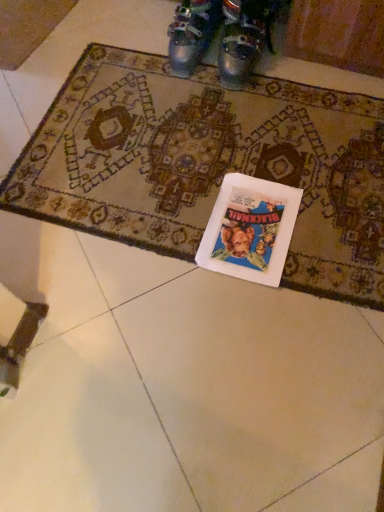
Question: Is metallic silver shoes at upper center, arranged as the 1th footwear when viewed from the right, in front of metallic silver boots at upper center, which is counted as the first footwear, starting from the left?

Choices:
 (A) yes
 (B) no

Answer: (A)

Question: Is metallic silver shoes at upper center, which ranks as the second footwear in left-to-right order, bigger than metallic silver boots at upper center, the second footwear when ordered from right to left?

Choices:
 (A) no
 (B) yes

Answer: (B)

Question: Can you confirm if metallic silver shoes at upper center, which ranks as the second footwear in left-to-right order, is positioned to the right of metallic silver boots at upper center, which is counted as the first footwear, starting from the left?

Choices:
 (A) yes
 (B) no

Answer: (A)

Question: Considering the relative sizes of metallic silver shoes at upper center, arranged as the 1th footwear when viewed from the right, and metallic silver boots at upper center, which is counted as the first footwear, starting from the left, in the image provided, is metallic silver shoes at upper center, arranged as the 1th footwear when viewed from the right, shorter than metallic silver boots at upper center, which is counted as the first footwear, starting from the left,?

Choices:
 (A) no
 (B) yes

Answer: (A)

Question: Is metallic silver shoes at upper center, arranged as the 1th footwear when viewed from the right, thinner than metallic silver boots at upper center, which is counted as the first footwear, starting from the left?

Choices:
 (A) no
 (B) yes

Answer: (A)

Question: From the image's perspective, is metallic silver shoes at upper center, which ranks as the second footwear in left-to-right order, below metallic silver boots at upper center, the second footwear when ordered from right to left?

Choices:
 (A) yes
 (B) no

Answer: (A)

Question: Can you confirm if metallic silver shoes at upper center, arranged as the 1th footwear when viewed from the right, is smaller than white paper book at center?

Choices:
 (A) yes
 (B) no

Answer: (B)

Question: Considering the relative sizes of metallic silver shoes at upper center, which ranks as the second footwear in left-to-right order, and white paper book at center in the image provided, is metallic silver shoes at upper center, which ranks as the second footwear in left-to-right order, wider than white paper book at center?

Choices:
 (A) yes
 (B) no

Answer: (B)

Question: Considering the relative sizes of metallic silver shoes at upper center, which ranks as the second footwear in left-to-right order, and white paper book at center in the image provided, is metallic silver shoes at upper center, which ranks as the second footwear in left-to-right order, taller than white paper book at center?

Choices:
 (A) yes
 (B) no

Answer: (A)

Question: Is metallic silver shoes at upper center, arranged as the 1th footwear when viewed from the right, further to the viewer compared to white paper book at center?

Choices:
 (A) yes
 (B) no

Answer: (A)

Question: From a real-world perspective, is metallic silver shoes at upper center, which ranks as the second footwear in left-to-right order, on top of white paper book at center?

Choices:
 (A) yes
 (B) no

Answer: (A)

Question: From a real-world perspective, is metallic silver shoes at upper center, which ranks as the second footwear in left-to-right order, physically below white paper book at center?

Choices:
 (A) no
 (B) yes

Answer: (A)

Question: Would you consider white paper book at center to be distant from metallic silver boots at upper center, the second footwear when ordered from right to left?

Choices:
 (A) yes
 (B) no

Answer: (B)